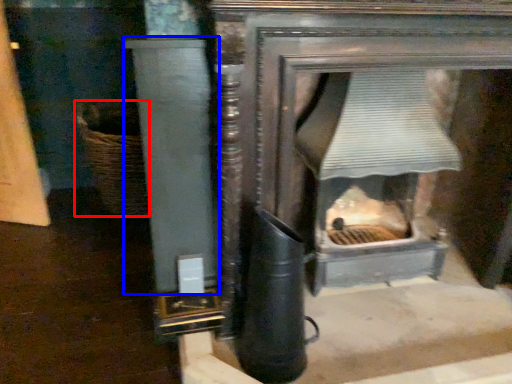
Question: Which object appears farthest to the camera in this image, basket (highlighted by a red box) or pillar (highlighted by a blue box)?

Choices:
 (A) basket
 (B) pillar

Answer: (A)